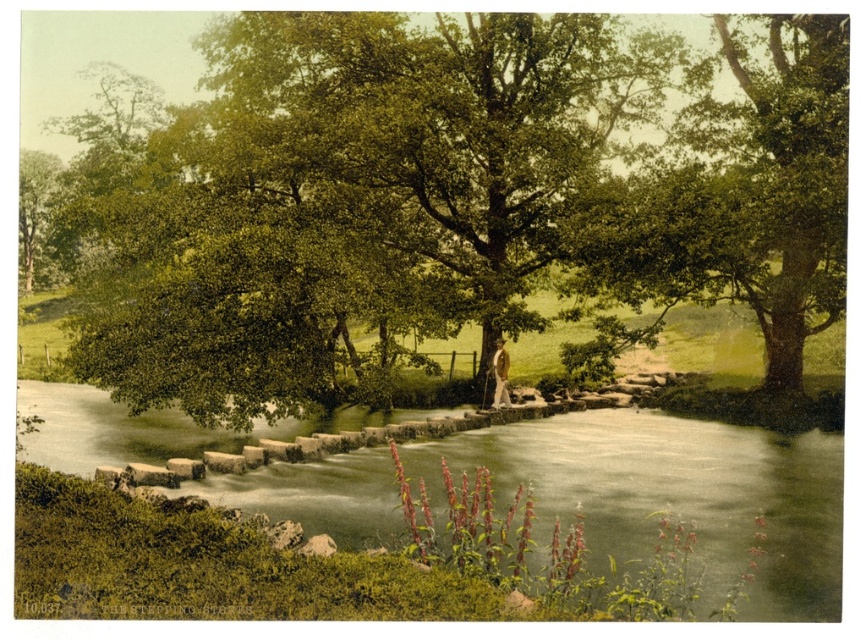
Between green leafy tree at center and smooth stone steps at center, which one has more height?

green leafy tree at center

Describe the element at coordinates (461, 195) in the screenshot. The width and height of the screenshot is (866, 640). I see `green leafy tree at center` at that location.

The image size is (866, 640). What do you see at coordinates (461, 195) in the screenshot?
I see `green leafy tree at center` at bounding box center [461, 195].

Where is `green leafy tree at center`? This screenshot has width=866, height=640. green leafy tree at center is located at coordinates (461, 195).

Does smooth stone steps at center have a smaller size compared to green leafy tree at upper right?

Indeed, smooth stone steps at center has a smaller size compared to green leafy tree at upper right.

Based on the photo, who is more distant from viewer, (437, 506) or (816, 104)?

The point (816, 104) is more distant.

Identify the location of smooth stone steps at center. The image size is (866, 640). (674, 493).

Which is behind, point (199, 51) or point (809, 272)?

The point (199, 51) is more distant.

In the scene shown: Can you confirm if green leafy tree at center is positioned below green leafy tree at upper right?

No, green leafy tree at center is not below green leafy tree at upper right.

What do you see at coordinates (461, 195) in the screenshot? I see `green leafy tree at center` at bounding box center [461, 195].

I want to click on green leafy tree at center, so click(461, 195).